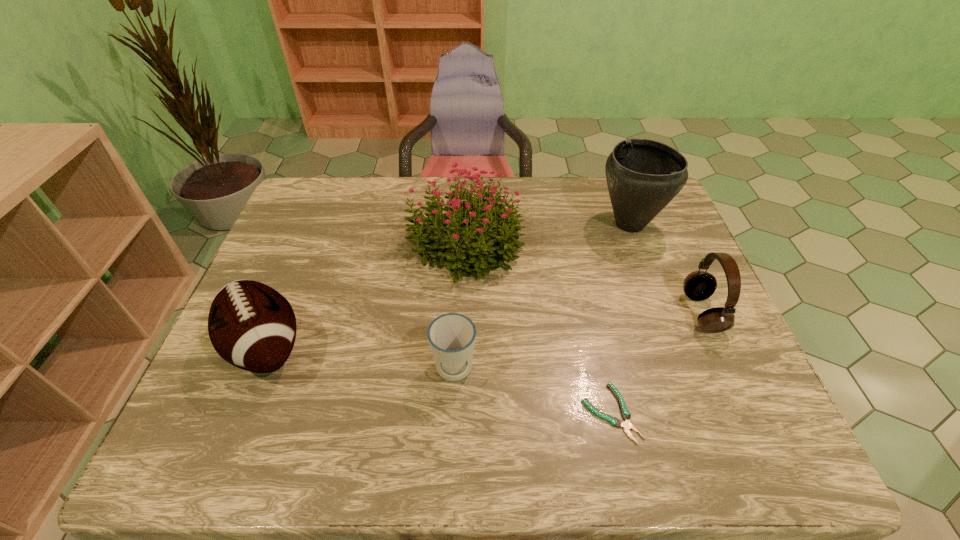
This screenshot has height=540, width=960. I want to click on bouquet, so click(x=469, y=240).

Image resolution: width=960 pixels, height=540 pixels. I want to click on urn, so click(643, 176).

Find the location of a particular element. headset is located at coordinates (699, 285).

This screenshot has height=540, width=960. I want to click on the leftmost object, so click(252, 326).

The image size is (960, 540). I want to click on the second shortest object, so click(451, 336).

Locate an element on the screen. the third object from right to left is located at coordinates (626, 415).

Find the location of a particular element. The width and height of the screenshot is (960, 540). pliers is located at coordinates (626, 415).

At what (x,y) coordinates should I click in order to perform the action: click on free location located 0.210m on the left of the bouquet. Please return your answer as a coordinate pair (x, y). The height and width of the screenshot is (540, 960). Looking at the image, I should click on (333, 245).

The image size is (960, 540). In order to click on free space located on the front of the urn in this screenshot , I will do [653, 286].

This screenshot has width=960, height=540. Find the location of `vacant space located on the ear pads of the headset`. vacant space located on the ear pads of the headset is located at coordinates (604, 313).